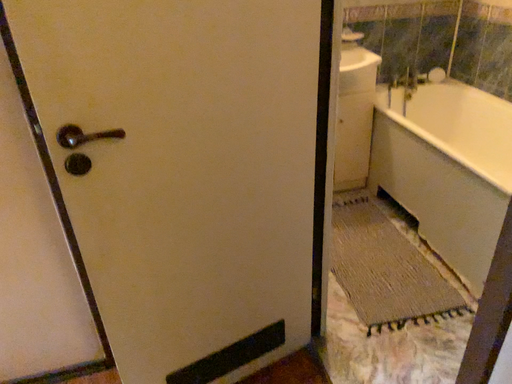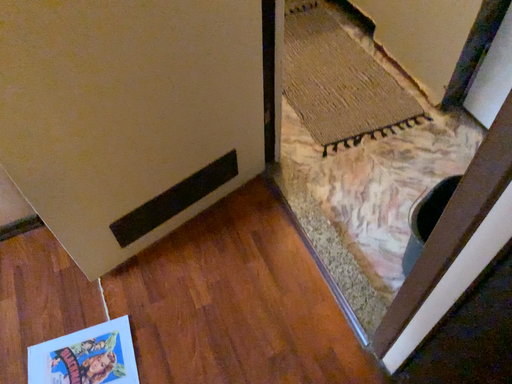
Question: Which way did the camera rotate in the video?

Choices:
 (A) rotated left
 (B) rotated right

Answer: (B)